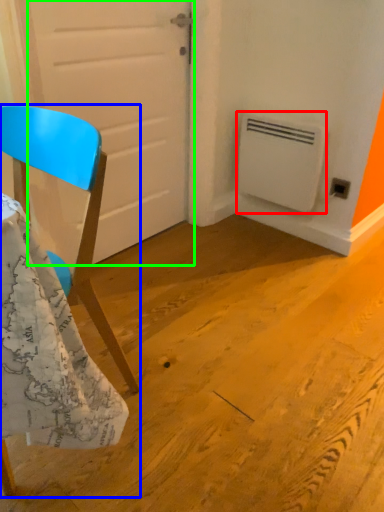
Question: Estimate the real-world distances between objects in this image. Which object is closer to air conditioning (highlighted by a red box), chair (highlighted by a blue box) or door (highlighted by a green box)?

Choices:
 (A) chair
 (B) door

Answer: (B)